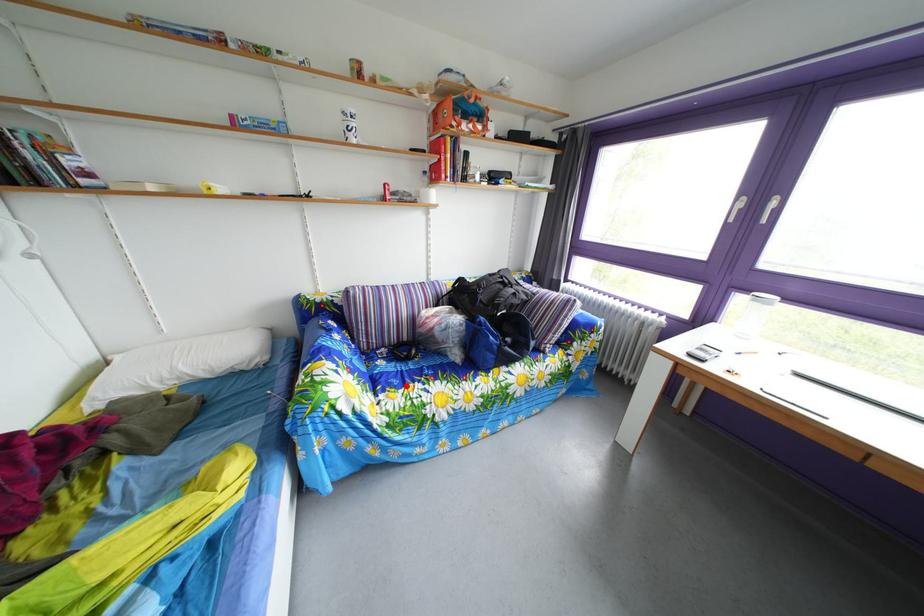
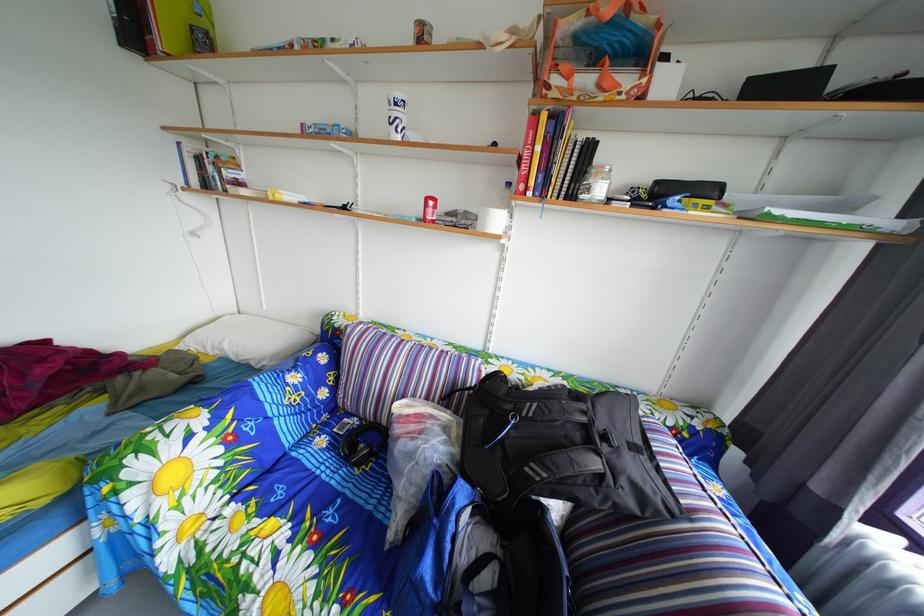
Where in the second image is the point corresponding to the highlighted location from the first image?

(301, 493)